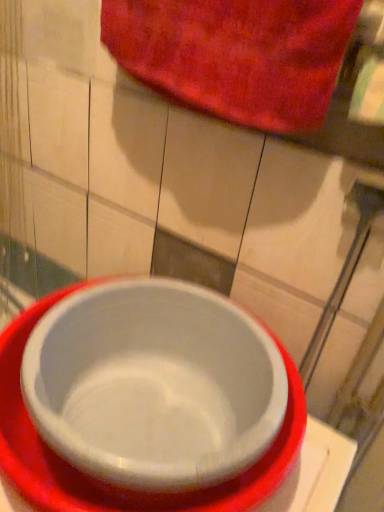
Question: Can you confirm if velvety red towel at upper center is smaller than white plastic bowl at center?

Choices:
 (A) yes
 (B) no

Answer: (A)

Question: Considering the relative sizes of velvety red towel at upper center and white plastic bowl at center in the image provided, is velvety red towel at upper center taller than white plastic bowl at center?

Choices:
 (A) yes
 (B) no

Answer: (B)

Question: Can you confirm if velvety red towel at upper center is shorter than white plastic bowl at center?

Choices:
 (A) yes
 (B) no

Answer: (A)

Question: From a real-world perspective, is velvety red towel at upper center over white plastic bowl at center?

Choices:
 (A) no
 (B) yes

Answer: (B)

Question: From the image's perspective, is velvety red towel at upper center over white plastic bowl at center?

Choices:
 (A) yes
 (B) no

Answer: (A)

Question: Is velvety red towel at upper center positioned behind white plastic bowl at center?

Choices:
 (A) yes
 (B) no

Answer: (A)

Question: Is the depth of white plastic bowl at center less than that of velvety red towel at upper center?

Choices:
 (A) no
 (B) yes

Answer: (B)

Question: From a real-world perspective, is white plastic bowl at center on top of velvety red towel at upper center?

Choices:
 (A) yes
 (B) no

Answer: (B)

Question: From a real-world perspective, does white plastic bowl at center sit lower than velvety red towel at upper center?

Choices:
 (A) yes
 (B) no

Answer: (A)

Question: Is velvety red towel at upper center a part of white plastic bowl at center?

Choices:
 (A) no
 (B) yes

Answer: (A)

Question: Can you confirm if white plastic bowl at center is smaller than velvety red towel at upper center?

Choices:
 (A) yes
 (B) no

Answer: (B)

Question: Is white plastic bowl at center wider than velvety red towel at upper center?

Choices:
 (A) no
 (B) yes

Answer: (B)

Question: From the image's perspective, relative to velvety red towel at upper center, is white plastic bowl at center above or below?

Choices:
 (A) above
 (B) below

Answer: (B)